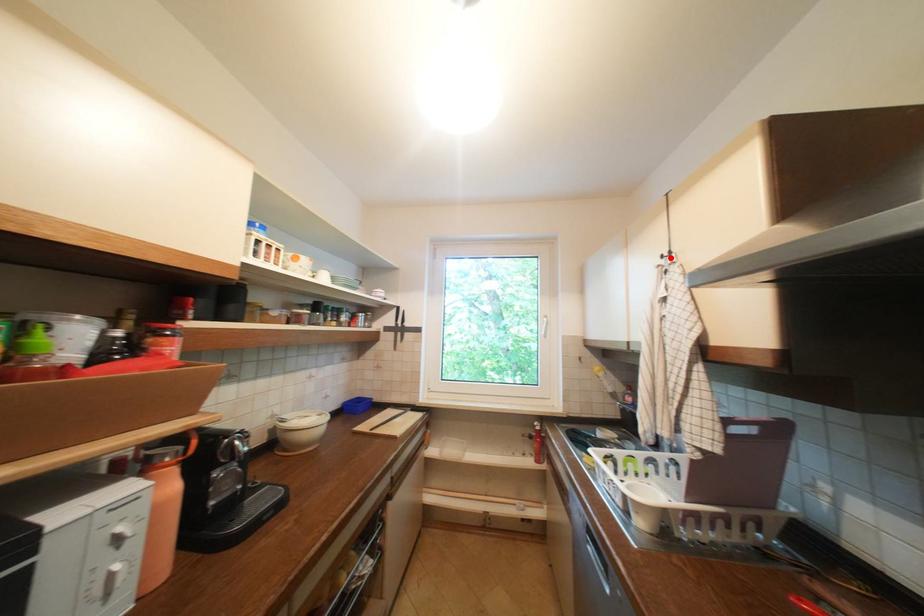
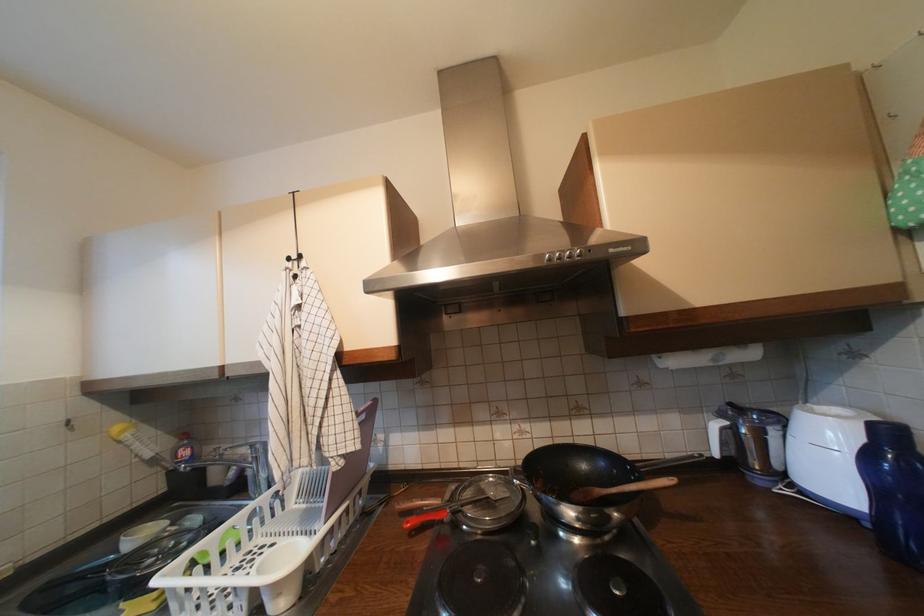
In the second image, find the point that corresponds to the highlighted location in the first image.

(297, 260)